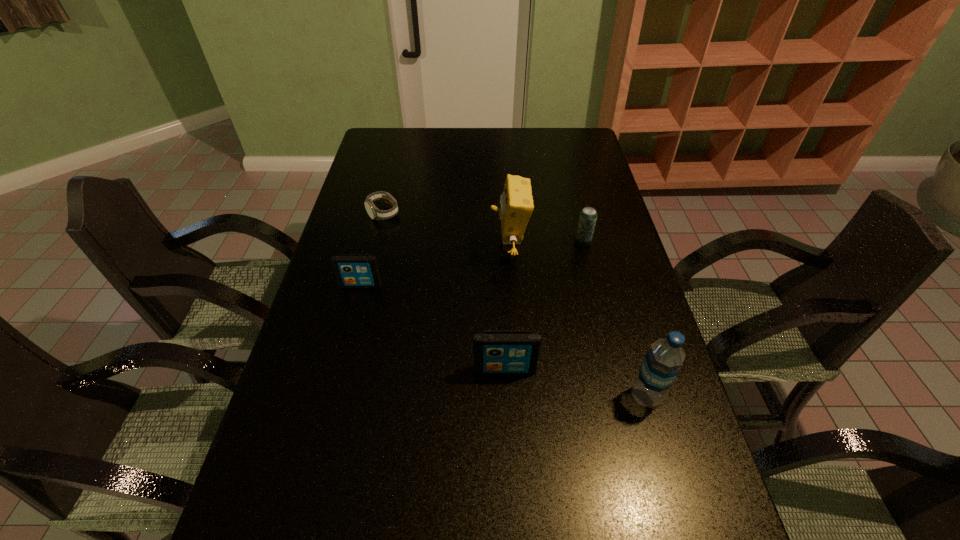
The height and width of the screenshot is (540, 960). What are the coordinates of `the left iPod` in the screenshot? It's located at (352, 270).

Find the location of a particular element. The image size is (960, 540). the shorter iPod is located at coordinates (352, 270).

The width and height of the screenshot is (960, 540). Identify the location of the nearer iPod. (495, 352).

Locate an element on the screen. the taller iPod is located at coordinates (495, 352).

In order to click on beer can in this screenshot , I will do `click(588, 216)`.

At what (x,y) coordinates should I click in order to perform the action: click on sponge. Please return your answer as a coordinate pair (x, y). Looking at the image, I should click on (516, 201).

Where is `the shortest object`? The width and height of the screenshot is (960, 540). the shortest object is located at coordinates (375, 214).

The width and height of the screenshot is (960, 540). What are the coordinates of `water bottle` in the screenshot? It's located at (662, 362).

Identify the location of vacant position located on the front screen of the shorter iPod. (347, 341).

You are a GUI agent. You are given a task and a screenshot of the screen. Output one action in this format:
    pyautogui.click(x=<x>, y=<y>)
    Task: Click on the free space located 0.070m on the front screen of the fifth farthest object
    Image resolution: width=960 pixels, height=540 pixels.
    Given the screenshot: What is the action you would take?
    pyautogui.click(x=507, y=403)